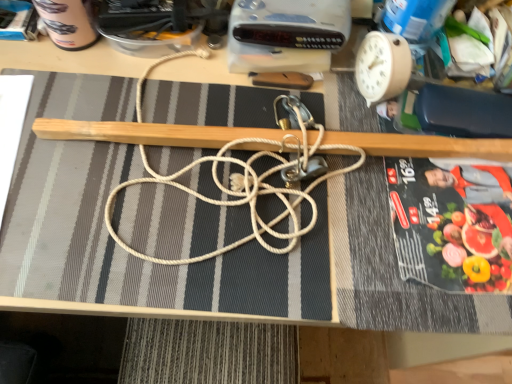
The image size is (512, 384). What do you see at coordinates (452, 223) in the screenshot? I see `black glossy paperback book at right, the 1th paperback book viewed from the front` at bounding box center [452, 223].

Measure the distance between black glossy paperback book at right, acting as the 2th paperback book starting from the left, and camera.

The depth of black glossy paperback book at right, acting as the 2th paperback book starting from the left, is 19.88 inches.

This screenshot has width=512, height=384. What do you see at coordinates (382, 66) in the screenshot?
I see `beige plastic clock at upper right` at bounding box center [382, 66].

At what (x,y) coordinates should I click in order to perform the action: click on white rope at center. Please return your answer as a coordinate pair (x, y). This screenshot has height=384, width=512. Looking at the image, I should click on (252, 185).

What's the angular difference between black glossy paperback book at right, acting as the 2th paperback book starting from the left, and beige plastic clock at upper right's facing directions?

The angular difference between black glossy paperback book at right, acting as the 2th paperback book starting from the left, and beige plastic clock at upper right is 73.5 degrees.

Is black glossy paperback book at right, arranged as the 2th paperback book when viewed from the top, facing away from beige plastic clock at upper right?

black glossy paperback book at right, arranged as the 2th paperback book when viewed from the top, is not turned away from beige plastic clock at upper right.

In the scene shown: From the image's perspective, relative to beige plastic clock at upper right, is black glossy paperback book at right, the 1th paperback book viewed from the front, above or below?

black glossy paperback book at right, the 1th paperback book viewed from the front, is below beige plastic clock at upper right.

Considering the positions of points (444, 168) and (367, 69), is point (444, 168) closer to camera compared to point (367, 69)?

Yes, it is in front of point (367, 69).

Is beige plastic clock at upper right shorter than matte black paperback book at upper left, the first paperback book in the left-to-right sequence?

No, beige plastic clock at upper right is not shorter than matte black paperback book at upper left, the first paperback book in the left-to-right sequence.

Can you confirm if beige plastic clock at upper right is positioned to the right of matte black paperback book at upper left, which is the 2th paperback book from bottom to top?

Correct, you'll find beige plastic clock at upper right to the right of matte black paperback book at upper left, which is the 2th paperback book from bottom to top.

Which point is more forward, (393, 51) or (17, 16)?

Point (393, 51)

Does beige plastic clock at upper right come behind matte black paperback book at upper left, the second paperback book when ordered from front to back?

That is False.

Does matte black paperback book at upper left, which appears as the 2th paperback book when viewed from the right, have a greater width compared to white rope at center?

In fact, matte black paperback book at upper left, which appears as the 2th paperback book when viewed from the right, might be narrower than white rope at center.

Can you confirm if matte black paperback book at upper left, the second paperback book when ordered from front to back, is positioned to the left of white rope at center?

Yes.

Is matte black paperback book at upper left, the second paperback book when ordered from front to back, looking in the opposite direction of white rope at center?

matte black paperback book at upper left, the second paperback book when ordered from front to back, does not have its back to white rope at center.

From the image's perspective, which one is positioned lower, matte black paperback book at upper left, marked as the 1th paperback book in a top-to-bottom arrangement, or white rope at center?

white rope at center appears lower in the image.

In the scene shown: Can you see white rope at center touching matte black paperback book at upper left, the first paperback book in the left-to-right sequence?

No, white rope at center is not making contact with matte black paperback book at upper left, the first paperback book in the left-to-right sequence.

Is white rope at center located outside matte black paperback book at upper left, which is the first paperback book in back-to-front order?

Yes.

Is white rope at center smaller than matte black paperback book at upper left, the second paperback book when ordered from front to back?

Incorrect, white rope at center is not smaller in size than matte black paperback book at upper left, the second paperback book when ordered from front to back.

Can you confirm if white rope at center is wider than matte black paperback book at upper left, the first paperback book in the left-to-right sequence?

Correct, the width of white rope at center exceeds that of matte black paperback book at upper left, the first paperback book in the left-to-right sequence.

Locate an element on the screen. The image size is (512, 384). clock lying behind the white rope at center is located at coordinates (382, 66).

Does white rope at center have a lesser width compared to beige plastic clock at upper right?

No, white rope at center is not thinner than beige plastic clock at upper right.

From a real-world perspective, is white rope at center located higher than beige plastic clock at upper right?

No.

Can you confirm if white rope at center is bigger than beige plastic clock at upper right?

Yes.

Could you tell me if beige plastic clock at upper right is turned towards black glossy paperback book at right, arranged as the 2th paperback book when viewed from the top?

No, beige plastic clock at upper right does not turn towards black glossy paperback book at right, arranged as the 2th paperback book when viewed from the top.

Is beige plastic clock at upper right positioned beyond the bounds of black glossy paperback book at right, which is counted as the 1th paperback book, starting from the right?

Yes, beige plastic clock at upper right is located beyond the bounds of black glossy paperback book at right, which is counted as the 1th paperback book, starting from the right.

Considering the relative sizes of beige plastic clock at upper right and black glossy paperback book at right, arranged as the 2th paperback book when viewed from the top, in the image provided, is beige plastic clock at upper right taller than black glossy paperback book at right, arranged as the 2th paperback book when viewed from the top,?

Yes, beige plastic clock at upper right is taller than black glossy paperback book at right, arranged as the 2th paperback book when viewed from the top.

Are beige plastic clock at upper right and black glossy paperback book at right, which is counted as the first paperback book, starting from the bottom, located far from each other?

beige plastic clock at upper right is actually quite close to black glossy paperback book at right, which is counted as the first paperback book, starting from the bottom.

The image size is (512, 384). I want to click on paperback book behind the black glossy paperback book at right, which is counted as the 1th paperback book, starting from the right, so click(18, 21).

How distant is black glossy paperback book at right, which is counted as the 2th paperback book, starting from the back, from matte black paperback book at upper left, the second paperback book when ordered from front to back?

A distance of 64.13 centimeters exists between black glossy paperback book at right, which is counted as the 2th paperback book, starting from the back, and matte black paperback book at upper left, the second paperback book when ordered from front to back.

Is black glossy paperback book at right, acting as the 2th paperback book starting from the left, aimed at matte black paperback book at upper left, which is the first paperback book in back-to-front order?

No, black glossy paperback book at right, acting as the 2th paperback book starting from the left, is not facing towards matte black paperback book at upper left, which is the first paperback book in back-to-front order.

How different are the orientations of black glossy paperback book at right, acting as the 2th paperback book starting from the left, and matte black paperback book at upper left, the first paperback book in the left-to-right sequence, in degrees?

They differ by 0.73 degrees in their facing directions.

Identify the location of paperback book that is the 1st object directly below the beige plastic clock at upper right (from a real-world perspective). coord(452,223).

Identify the location of clock that appears below the matte black paperback book at upper left, the first paperback book in the left-to-right sequence (from the image's perspective). (382, 66).

Estimate the real-world distances between objects in this image. Which object is further from matte black paperback book at upper left, which is the first paperback book in back-to-front order, beige plastic clock at upper right or black glossy paperback book at right, arranged as the 2th paperback book when viewed from the top?

black glossy paperback book at right, arranged as the 2th paperback book when viewed from the top, is further to matte black paperback book at upper left, which is the first paperback book in back-to-front order.

Based on their spatial positions, is matte black paperback book at upper left, the second paperback book when ordered from front to back, or beige plastic clock at upper right closer to black glossy paperback book at right, which is counted as the 2th paperback book, starting from the back?

Based on the image, beige plastic clock at upper right appears to be nearer to black glossy paperback book at right, which is counted as the 2th paperback book, starting from the back.

When comparing their distances from beige plastic clock at upper right, does black glossy paperback book at right, which is counted as the 1th paperback book, starting from the right, or white rope at center seem closer?

Based on the image, black glossy paperback book at right, which is counted as the 1th paperback book, starting from the right, appears to be nearer to beige plastic clock at upper right.

When comparing their distances from white rope at center, does beige plastic clock at upper right or matte black paperback book at upper left, the second paperback book when ordered from front to back, seem closer?

beige plastic clock at upper right lies closer to white rope at center than the other object.

In the scene shown: Which object lies further to the anchor point white rope at center, matte black paperback book at upper left, which appears as the 2th paperback book when viewed from the right, or black glossy paperback book at right, which is counted as the first paperback book, starting from the bottom?

matte black paperback book at upper left, which appears as the 2th paperback book when viewed from the right, is positioned further to the anchor white rope at center.

When comparing their distances from black glossy paperback book at right, acting as the 2th paperback book starting from the left, does beige plastic clock at upper right or matte black paperback book at upper left, the second paperback book when ordered from front to back, seem closer?

beige plastic clock at upper right is closer to black glossy paperback book at right, acting as the 2th paperback book starting from the left.

Considering their positions, is black glossy paperback book at right, the 1th paperback book viewed from the front, positioned further to beige plastic clock at upper right than matte black paperback book at upper left, the first paperback book in the left-to-right sequence?

matte black paperback book at upper left, the first paperback book in the left-to-right sequence.

Which object lies further to the anchor point beige plastic clock at upper right, white rope at center or matte black paperback book at upper left, which is the first paperback book in back-to-front order?

The object further to beige plastic clock at upper right is matte black paperback book at upper left, which is the first paperback book in back-to-front order.

In order to click on string between matte black paperback book at upper left, the first paperback book in the left-to-right sequence, and black glossy paperback book at right, arranged as the 2th paperback book when viewed from the top, in the horizontal direction in this screenshot , I will do `click(252, 185)`.

Locate an element on the screen. This screenshot has width=512, height=384. string located between matte black paperback book at upper left, which is the 2th paperback book from bottom to top, and beige plastic clock at upper right in the left-right direction is located at coordinates (252, 185).

At what (x,y) coordinates should I click in order to perform the action: click on clock situated between white rope at center and black glossy paperback book at right, which is counted as the first paperback book, starting from the bottom, from left to right. Please return your answer as a coordinate pair (x, y). Looking at the image, I should click on (382, 66).

Image resolution: width=512 pixels, height=384 pixels. Find the location of `clock situated between matte black paperback book at upper left, marked as the 1th paperback book in a top-to-bottom arrangement, and black glossy paperback book at right, arranged as the 2th paperback book when viewed from the top, from left to right`. clock situated between matte black paperback book at upper left, marked as the 1th paperback book in a top-to-bottom arrangement, and black glossy paperback book at right, arranged as the 2th paperback book when viewed from the top, from left to right is located at coordinates (382, 66).